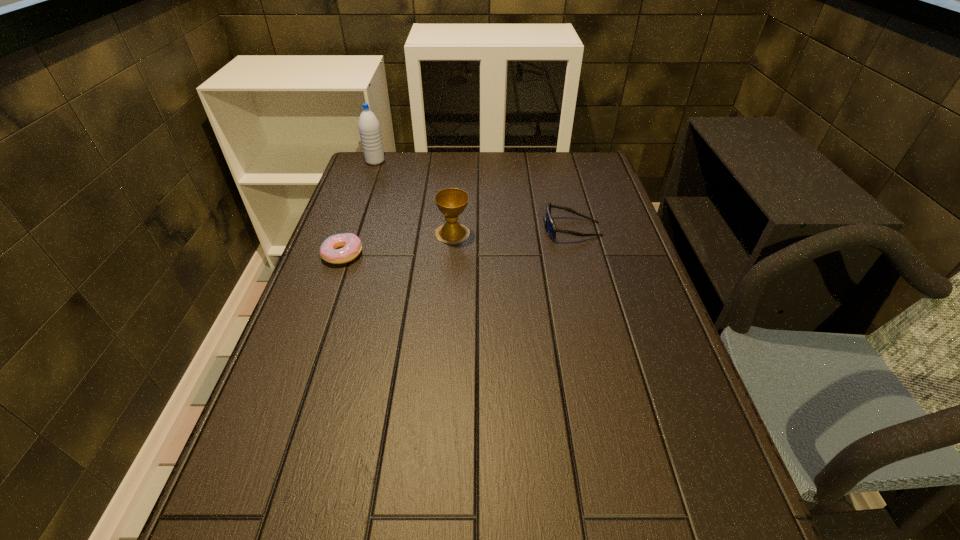
The width and height of the screenshot is (960, 540). I want to click on the tallest object, so click(x=369, y=128).

The width and height of the screenshot is (960, 540). What are the coordinates of `the farthest object` in the screenshot? It's located at (369, 128).

At what (x,y) coordinates should I click in order to perform the action: click on chalice. Please return your answer as a coordinate pair (x, y). This screenshot has height=540, width=960. Looking at the image, I should click on (451, 202).

Image resolution: width=960 pixels, height=540 pixels. I want to click on the third shortest object, so click(451, 202).

Find the location of a particular element. the third tallest object is located at coordinates (550, 226).

This screenshot has width=960, height=540. I want to click on sunglasses, so click(550, 226).

Identify the location of doughnut. (351, 244).

You are a GUI agent. You are given a task and a screenshot of the screen. Output one action in this format:
    pyautogui.click(x=<x>, y=<y>)
    Task: Click on the vacant space located on the right of the farthest object
    
    Given the screenshot: What is the action you would take?
    pyautogui.click(x=473, y=161)

Find the location of a particular element. vacant space located 0.320m on the back of the chalice is located at coordinates (457, 168).

Image resolution: width=960 pixels, height=540 pixels. What are the coordinates of `vacant space situated on the front-facing side of the rightmost object` in the screenshot? It's located at (452, 229).